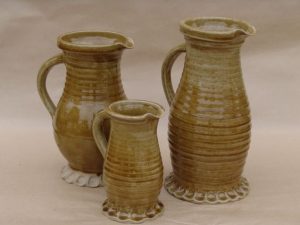
Locate an element on the screen. Image resolution: width=300 pixels, height=225 pixels. large pitcher base is located at coordinates (206, 192).